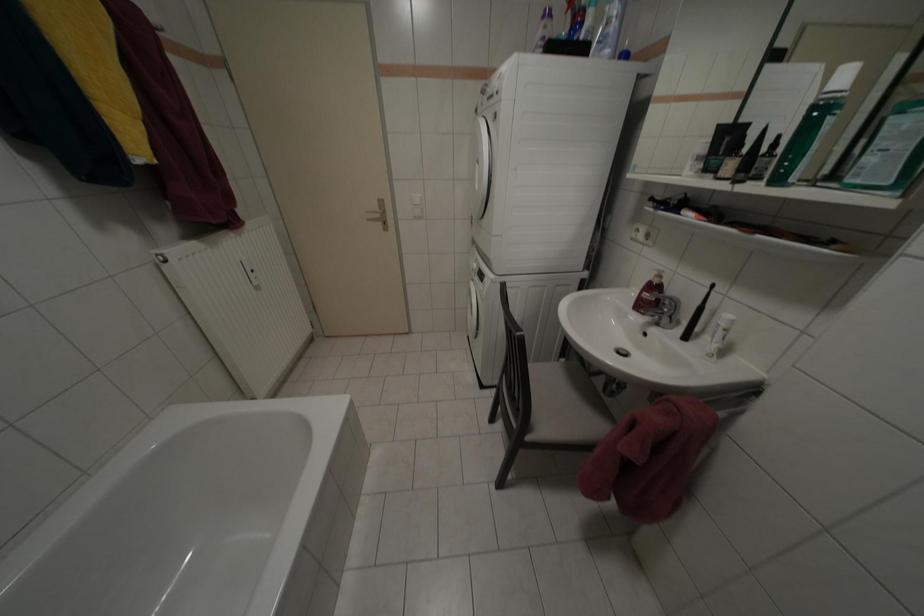
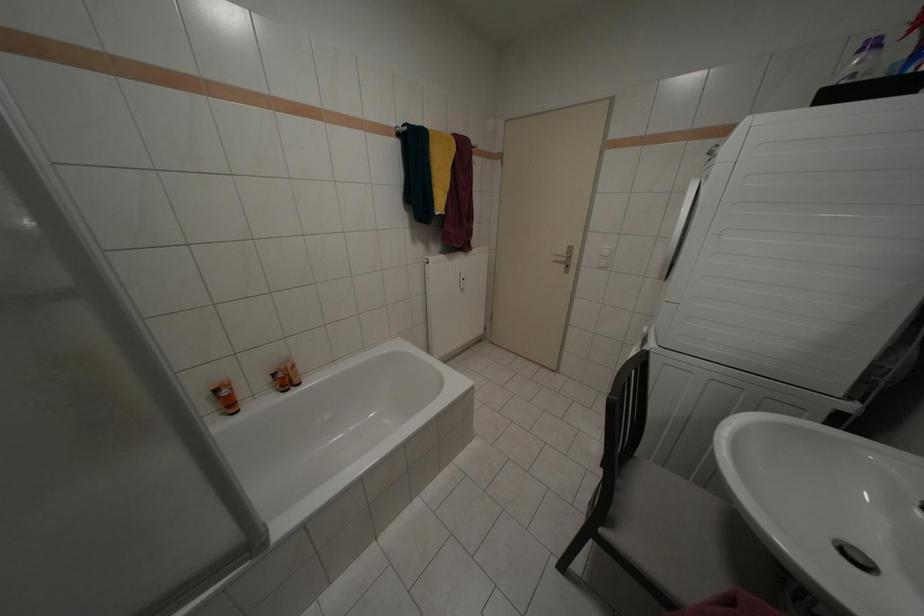
Question: Based on the continuous images, in which direction is the camera rotating? Reply with the corresponding letter.

Choices:
 (A) Left
 (B) Right
 (C) Up
 (D) Down

Answer: (A)